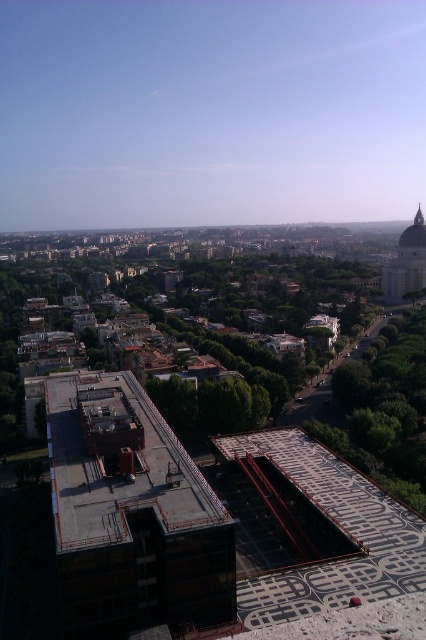
Can you confirm if white marble dome at upper right is smaller than matte white dome at upper right?

No, white marble dome at upper right is not smaller than matte white dome at upper right.

Is the position of white marble dome at upper right less distant than that of matte white dome at upper right?

That is True.

Does point (397, 296) come in front of point (420, 232)?

Yes, point (397, 296) is in front of point (420, 232).

I want to click on white marble dome at upper right, so click(x=406, y=260).